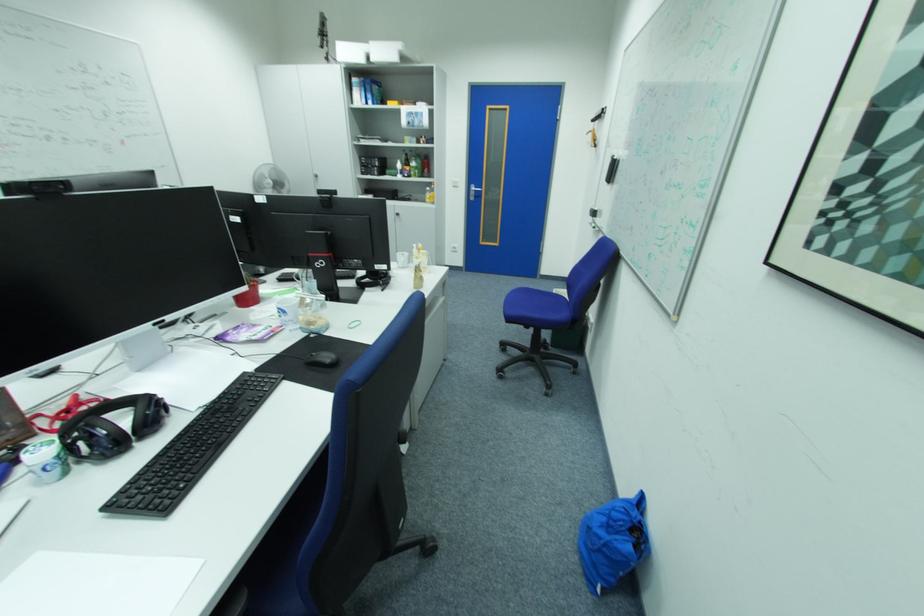
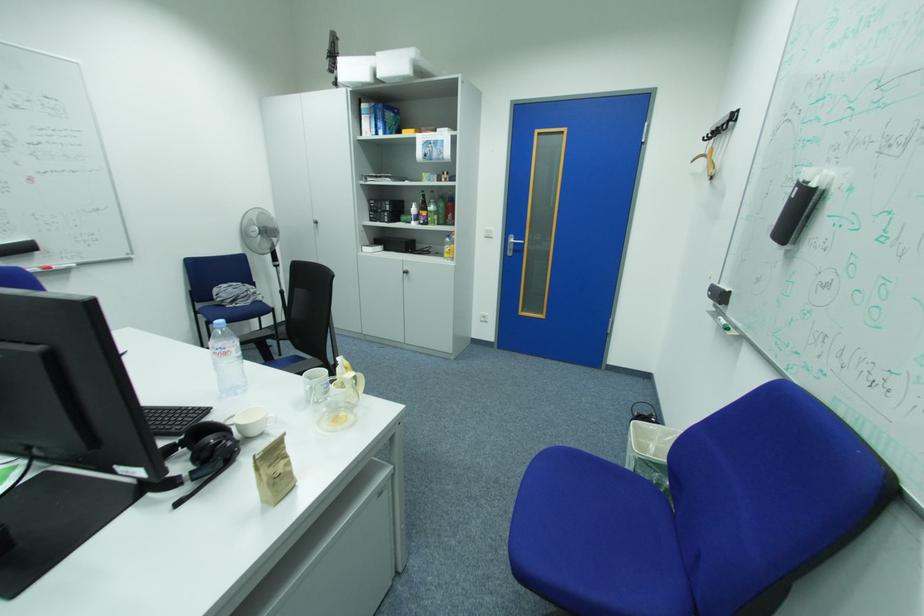
Locate, in the second image, the point that corresponds to pixel 424 276 in the first image.

(268, 476)